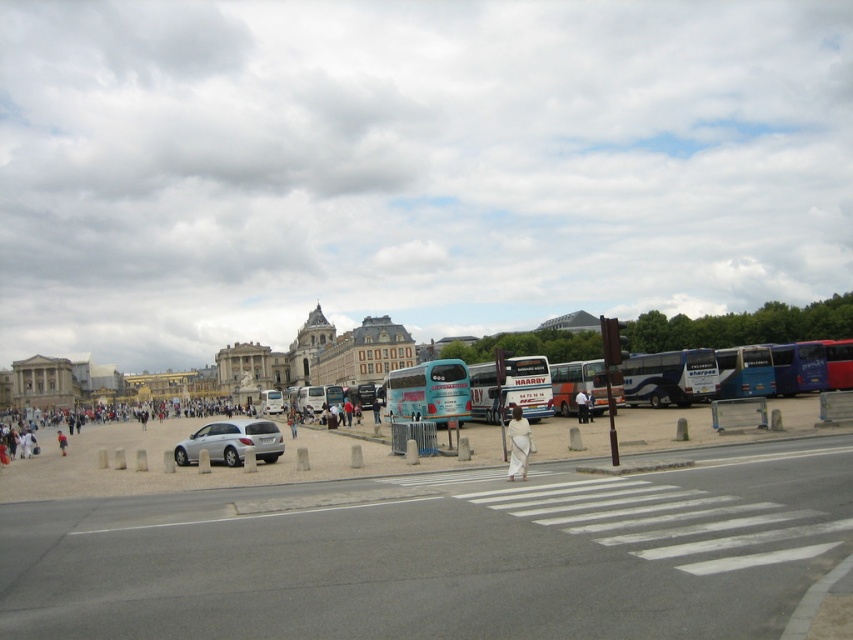
Question: Which of the following is the closest to the observer?

Choices:
 (A) concrete plaza at center
 (B) white cloth at center

Answer: (A)

Question: Observing the image, what is the correct spatial positioning of satin silver sedan at center in reference to light brown leather jacket at lower left?

Choices:
 (A) left
 (B) right

Answer: (B)

Question: Which point is farther from the camera taking this photo?

Choices:
 (A) (587, 401)
 (B) (628, 372)
 (C) (193, 456)

Answer: (B)

Question: Among these objects, which one is nearest to the camera?

Choices:
 (A) white cloth at center
 (B) satin silver sedan at center
 (C) teal glossy bus at center
 (D) teal matte double-decker bus at center

Answer: (A)

Question: Is concrete plaza at center wider than teal matte double-decker bus at center?

Choices:
 (A) yes
 (B) no

Answer: (A)

Question: Is white cloth at center below light brown leather jacket at lower left?

Choices:
 (A) no
 (B) yes

Answer: (A)